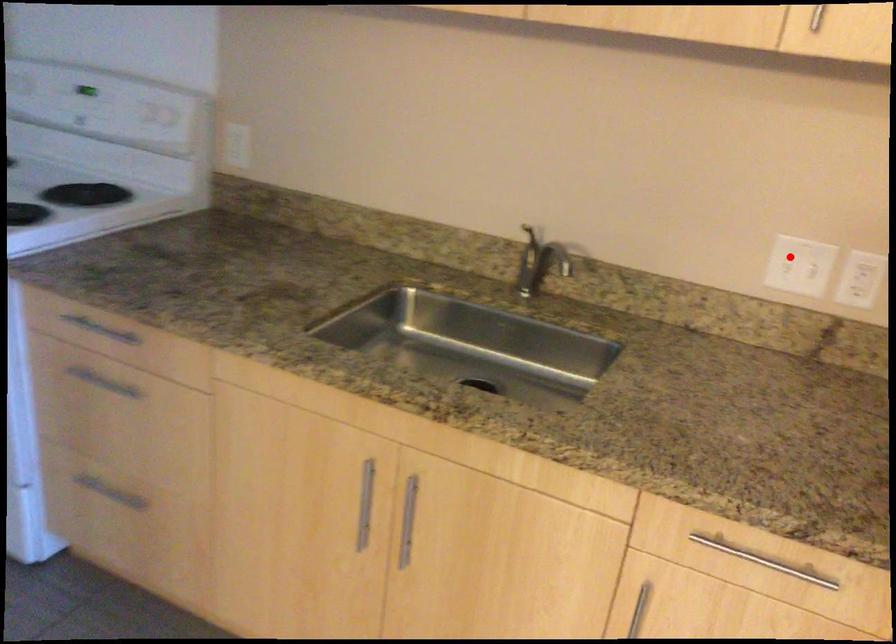
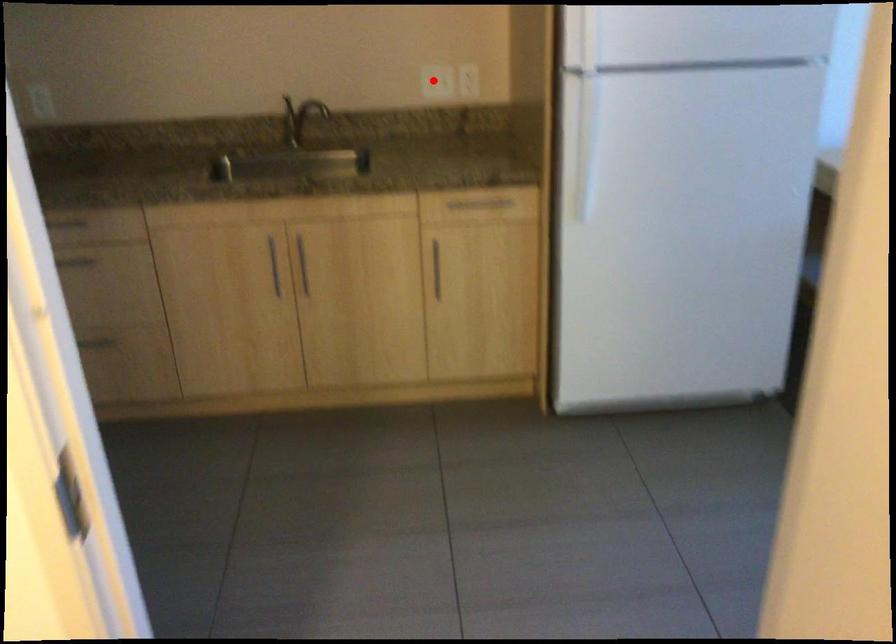
I am providing you with two images of the same scene from different viewpoints. A red point is marked on the first image and another point is marked on the second image. Is the red point in image1 aligned with the point shown in image2?

Yes